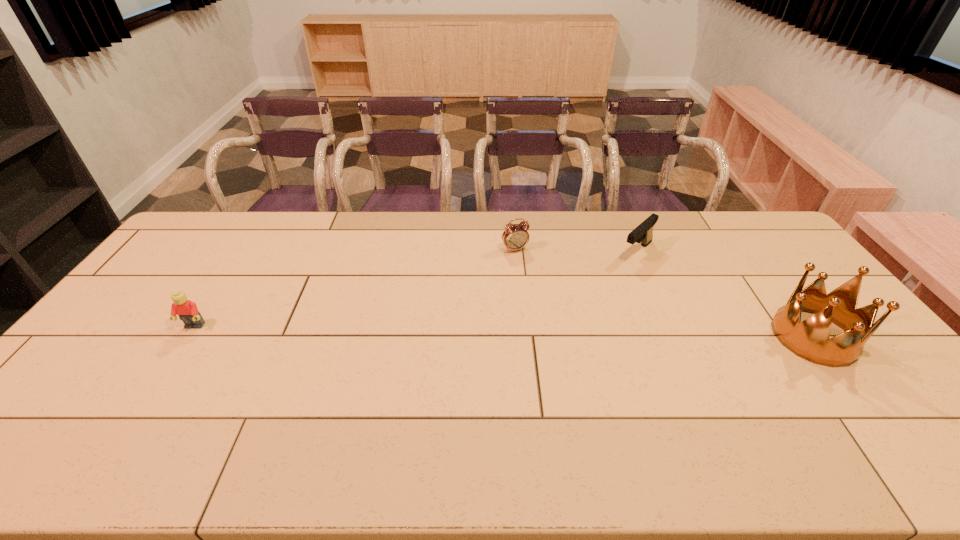
Find the location of a particular element. vacant space located 0.140m on the front-facing side of the second object from right to left is located at coordinates (606, 282).

This screenshot has height=540, width=960. Identify the location of free space located 0.360m on the front-facing side of the second object from right to left. tap(566, 319).

Locate an element on the screen. free space located on the front-facing side of the second object from right to left is located at coordinates (586, 301).

Where is `alarm clock positioned at the far edge`? alarm clock positioned at the far edge is located at coordinates (515, 236).

Where is `pistol that is positioned at the far edge`? pistol that is positioned at the far edge is located at coordinates (643, 233).

The image size is (960, 540). I want to click on object at the right edge, so click(x=810, y=339).

At what (x,y) coordinates should I click in order to perform the action: click on vacant position at the far edge of the desktop. Please return your answer as a coordinate pair (x, y). Looking at the image, I should click on (407, 240).

Find the location of a particular element. This screenshot has height=540, width=960. vacant space at the near edge of the desktop is located at coordinates (496, 415).

Find the location of a particular element. The height and width of the screenshot is (540, 960). free space at the left edge of the desktop is located at coordinates (170, 265).

Where is `free space at the right edge of the desktop`? free space at the right edge of the desktop is located at coordinates (767, 281).